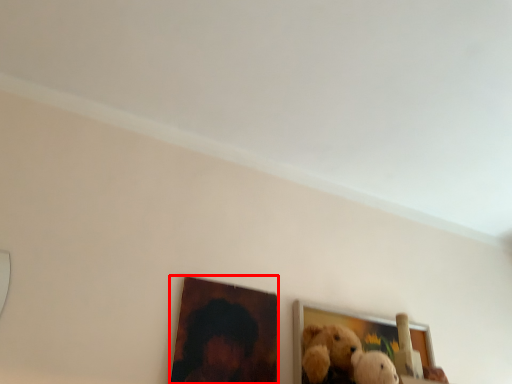
Question: From the image's perspective, what is the correct spatial positioning of picture frame (annotated by the red box) in reference to picture frame?

Choices:
 (A) above
 (B) below

Answer: (A)